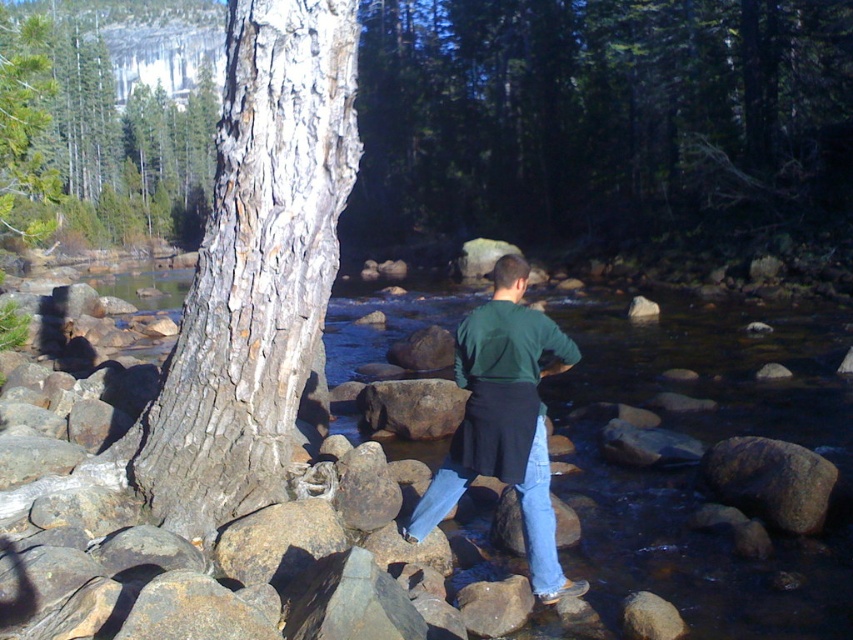
Question: Among these objects, which one is nearest to the camera?

Choices:
 (A) smooth bark tree at center
 (B) green matte shirt at center
 (C) smooth bark tree at upper left
 (D) brown rough rock at lower right

Answer: (B)

Question: Can you confirm if grayish-brown bark tree trunk at left is positioned to the left of green matte shirt at center?

Choices:
 (A) no
 (B) yes

Answer: (B)

Question: Which object is farther from the camera taking this photo?

Choices:
 (A) brown rough rock at center
 (B) smooth bark tree at upper left
 (C) brown rough rock at lower right
 (D) smooth bark tree at center

Answer: (B)

Question: Does smooth bark tree at center have a smaller size compared to brown rough rock at lower right?

Choices:
 (A) no
 (B) yes

Answer: (A)

Question: Is grayish-brown bark tree trunk at left to the left of smooth bark tree at upper left from the viewer's perspective?

Choices:
 (A) no
 (B) yes

Answer: (A)

Question: Which of these objects is positioned closest to the smooth bark tree at upper left?

Choices:
 (A) grayish-brown bark tree trunk at left
 (B) smooth bark tree at center

Answer: (B)